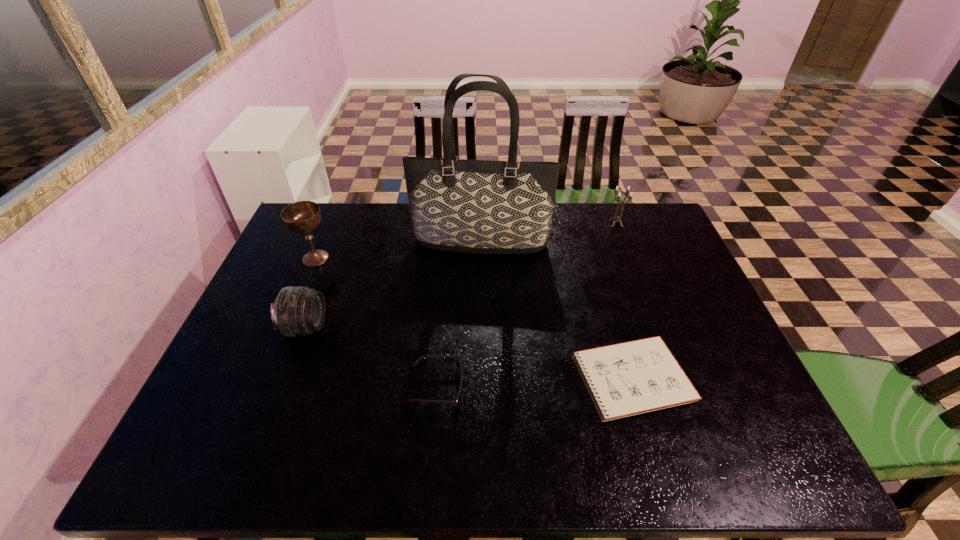
Find the location of a particular element. vacant area located 0.260m on the front-facing side of the second shortest object is located at coordinates (574, 388).

I want to click on vacant space located on the left of the shortest object, so click(468, 379).

You are a GUI agent. You are given a task and a screenshot of the screen. Output one action in this format:
    pyautogui.click(x=<x>, y=<y>)
    Task: Click on the tote bag that is positioned at the far edge
    
    Given the screenshot: What is the action you would take?
    pyautogui.click(x=471, y=206)

You are a GUI agent. You are given a task and a screenshot of the screen. Output one action in this format:
    pyautogui.click(x=<x>, y=<y>)
    Task: Click on the candle holder that is at the far edge
    This screenshot has width=960, height=540.
    Given the screenshot: What is the action you would take?
    pyautogui.click(x=617, y=218)

Find the location of a particular element. chalice situated at the left edge is located at coordinates (304, 216).

This screenshot has height=540, width=960. I want to click on telephoto lens present at the left edge, so [297, 310].

Find the location of a particular element. The width and height of the screenshot is (960, 540). candle holder that is at the right edge is located at coordinates (617, 218).

Find the location of a particular element. Image resolution: width=960 pixels, height=540 pixels. notepad that is at the right edge is located at coordinates (631, 378).

Where is `object at the far right corner`? The image size is (960, 540). object at the far right corner is located at coordinates (617, 218).

In the image, there is a desktop. Identify the location of vacant region at the far edge. (571, 235).